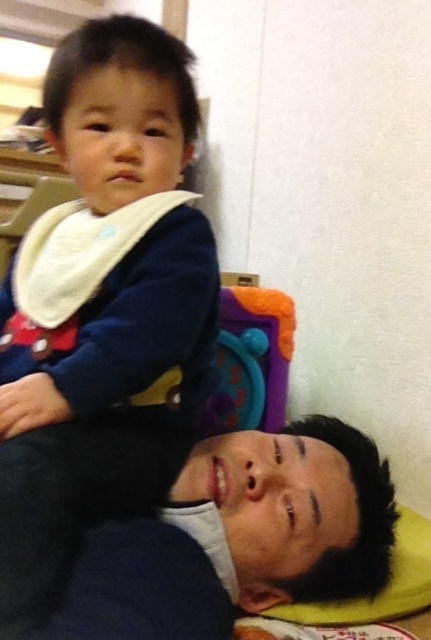
Question: Which point appears closest to the camera in this image?

Choices:
 (A) (328, 545)
 (B) (114, 77)

Answer: (B)

Question: Is black matte shirt at lower left below white soft bib at upper left?

Choices:
 (A) yes
 (B) no

Answer: (A)

Question: From the image, what is the correct spatial relationship of black matte shirt at lower left in relation to white soft bib at upper left?

Choices:
 (A) right
 (B) left

Answer: (A)

Question: Which point is closer to the camera taking this photo?

Choices:
 (A) (152, 342)
 (B) (296, 499)

Answer: (A)

Question: Can you confirm if black matte shirt at lower left is positioned to the right of white soft bib at upper left?

Choices:
 (A) no
 (B) yes

Answer: (B)